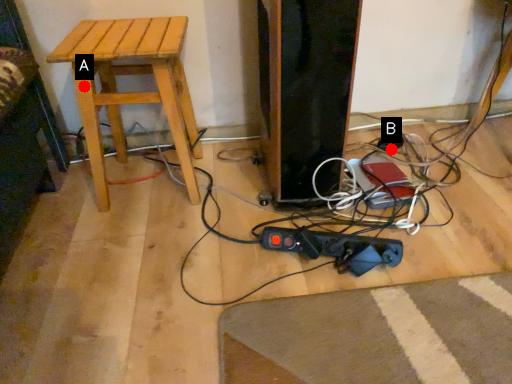
Question: Two points are circled on the image, labeled by A and B beside each circle. Which point appears farthest from the camera in this image?

Choices:
 (A) A is further
 (B) B is further

Answer: (B)